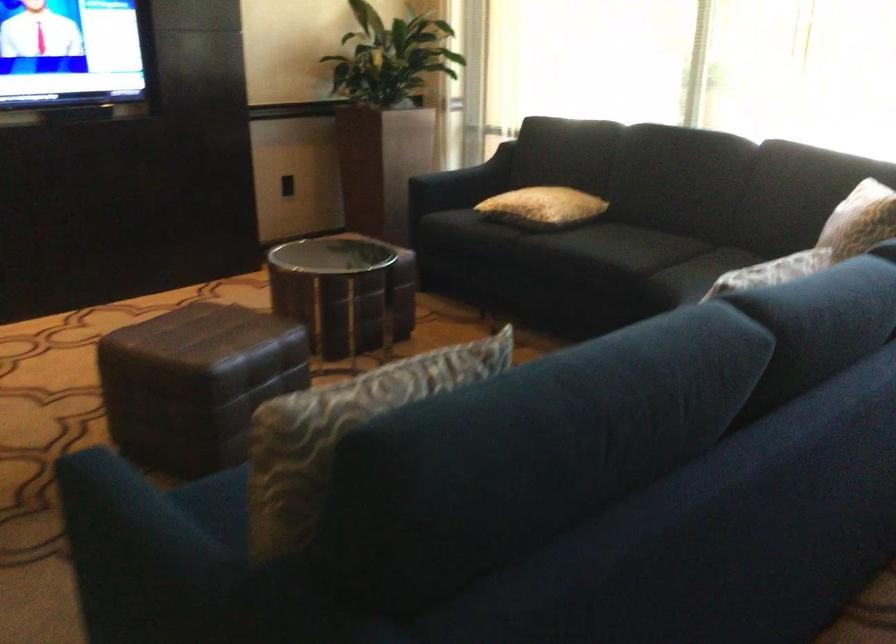
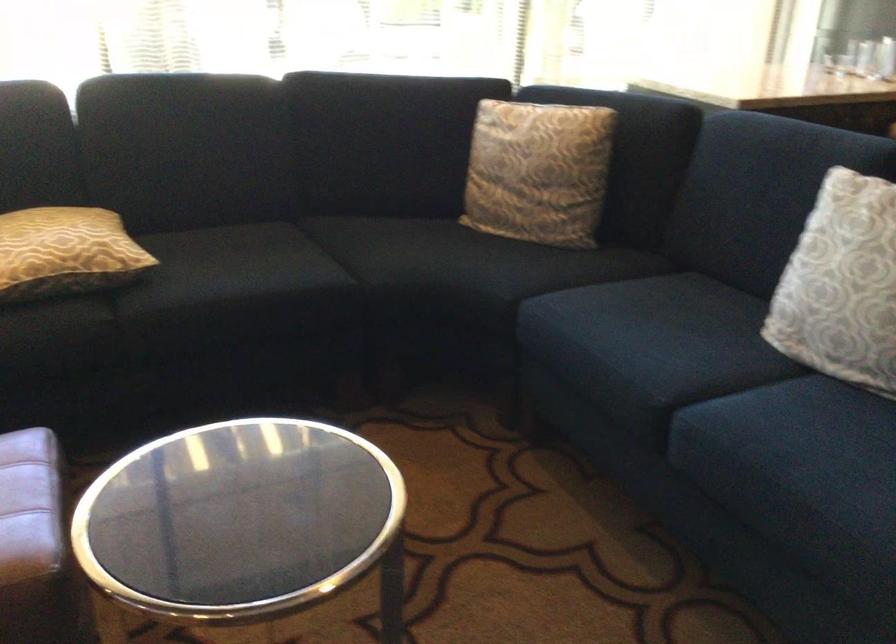
The point at [521,202] is marked in the first image. Where is the corresponding point in the second image?

(65, 252)